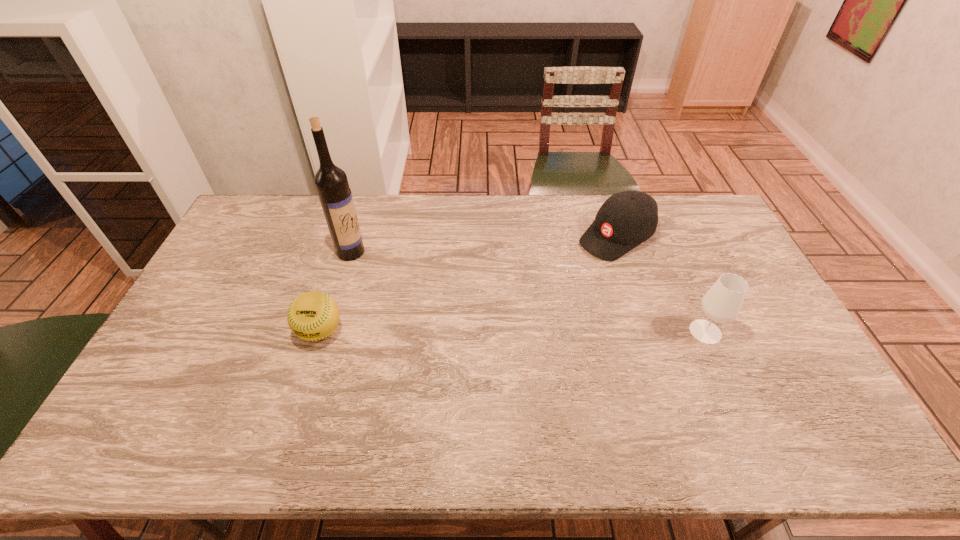
Find the location of a particular element. The height and width of the screenshot is (540, 960). free space in the image that satisfies the following two spatial constraints: 1. on the logo side of the softball; 2. on the left side of the glass is located at coordinates (320, 332).

The image size is (960, 540). Identify the location of vacant space that satisfies the following two spatial constraints: 1. on the back side of the tallest object; 2. on the right side of the baseball cap. (355, 237).

Locate an element on the screen. This screenshot has width=960, height=540. free space in the image that satisfies the following two spatial constraints: 1. on the logo side of the softball; 2. on the left side of the second tallest object is located at coordinates (320, 332).

Locate an element on the screen. Image resolution: width=960 pixels, height=540 pixels. vacant position in the image that satisfies the following two spatial constraints: 1. on the front side of the glass; 2. on the right side of the wine bottle is located at coordinates (327, 332).